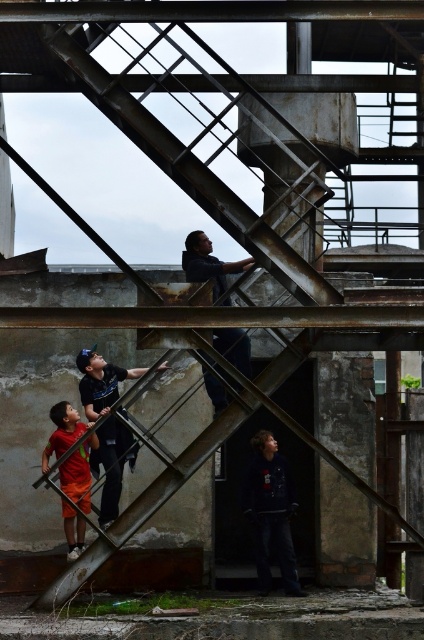
You are a photographer trying to capture a shot of the two children in the scene. You notice the orange cotton shorts at lower left and the dark blue shirt at center. Which child is positioned further to the left side of the image?

The orange cotton shorts at lower left are positioned to the left of the dark blue shirt at center, so the child wearing the orange cotton shorts at lower left is further to the left.

You are standing at the entrance of the abandoned industrial structure and see two points marked in the scene. Which point, point (64,481) or point (240,332), is closer to you?

Point (64,481) is closer to the viewer than point (240,332).